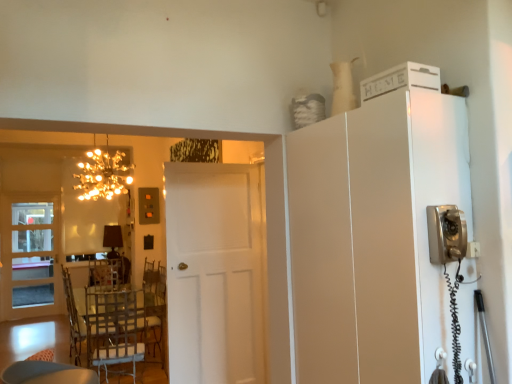
Question: Is white matte cabinet at upper right, arranged as the 2th appliance when viewed from the front, closer to camera compared to translucent glass door at left, the 2th door in the front-to-back sequence?

Choices:
 (A) no
 (B) yes

Answer: (B)

Question: Does white matte cabinet at upper right, the second appliance when ordered from bottom to top, have a lesser height compared to translucent glass door at left, the 2th door in the front-to-back sequence?

Choices:
 (A) yes
 (B) no

Answer: (A)

Question: Can you confirm if white matte cabinet at upper right, arranged as the 2th appliance when viewed from the front, is wider than translucent glass door at left, the 1th door from the back?

Choices:
 (A) yes
 (B) no

Answer: (A)

Question: Is white matte cabinet at upper right, arranged as the 2th appliance when viewed from the front, oriented away from translucent glass door at left, which appears as the first door when viewed from the left?

Choices:
 (A) yes
 (B) no

Answer: (A)

Question: From a real-world perspective, is white matte cabinet at upper right, placed as the first appliance when sorted from top to bottom, physically below translucent glass door at left, which appears as the first door when viewed from the left?

Choices:
 (A) no
 (B) yes

Answer: (A)

Question: Are white matte cabinet at upper right, arranged as the 2th appliance when viewed from the front, and translucent glass door at left, which appears as the first door when viewed from the left, making contact?

Choices:
 (A) no
 (B) yes

Answer: (A)

Question: Does satin silver telephone at right, which appears as the 2th appliance when viewed from the top, come in front of white matte cabinet at upper right?

Choices:
 (A) no
 (B) yes

Answer: (B)

Question: Is satin silver telephone at right, which is counted as the 1th appliance, starting from the front, bigger than white matte cabinet at upper right?

Choices:
 (A) yes
 (B) no

Answer: (B)

Question: Is satin silver telephone at right, which appears as the 2th appliance when viewed from the top, smaller than white matte cabinet at upper right?

Choices:
 (A) yes
 (B) no

Answer: (A)

Question: Is satin silver telephone at right, which appears as the 2th appliance when viewed from the top, not near white matte cabinet at upper right?

Choices:
 (A) yes
 (B) no

Answer: (B)

Question: Is white matte cabinet at upper right a part of satin silver telephone at right, which is the first appliance from bottom to top?

Choices:
 (A) yes
 (B) no

Answer: (B)

Question: From the image's perspective, would you say satin silver telephone at right, which is counted as the 1th appliance, starting from the front, is shown under white matte cabinet at upper right?

Choices:
 (A) no
 (B) yes

Answer: (A)

Question: Considering the relative sizes of white matte door at center, which ranks as the first door in front-to-back order, and white matte cabinet at upper right, which is the 1th appliance in back-to-front order, in the image provided, is white matte door at center, which ranks as the first door in front-to-back order, thinner than white matte cabinet at upper right, which is the 1th appliance in back-to-front order,?

Choices:
 (A) no
 (B) yes

Answer: (B)